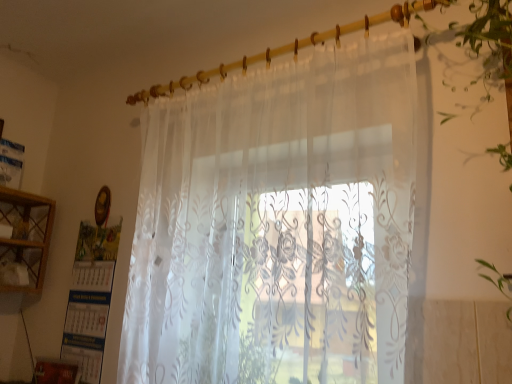
The height and width of the screenshot is (384, 512). What are the coordinates of `wooden cabinet at left` in the screenshot? It's located at (27, 234).

In order to click on translucent floral curtain at right in this screenshot , I will do (x=490, y=58).

Which is in front, translucent floral-patterned curtain at center or translucent floral curtain at right?

Positioned in front is translucent floral curtain at right.

Considering the sizes of objects translucent floral-patterned curtain at center and translucent floral curtain at right in the image provided, who is smaller, translucent floral-patterned curtain at center or translucent floral curtain at right?

Smaller between the two is translucent floral curtain at right.

How much distance is there between translucent floral-patterned curtain at center and translucent floral curtain at right?

translucent floral-patterned curtain at center and translucent floral curtain at right are 62.79 centimeters apart from each other.

Looking at this image, how many degrees apart are the facing directions of wooden cabinet at left and translucent floral-patterned curtain at center?

90.8 degrees separate the facing orientations of wooden cabinet at left and translucent floral-patterned curtain at center.

The image size is (512, 384). In order to click on cabinet lying behind the translucent floral-patterned curtain at center in this screenshot , I will do `click(27, 234)`.

In the scene shown: Considering the relative positions of wooden cabinet at left and translucent floral-patterned curtain at center in the image provided, is wooden cabinet at left to the left of translucent floral-patterned curtain at center from the viewer's perspective?

Correct, you'll find wooden cabinet at left to the left of translucent floral-patterned curtain at center.

From a real-world perspective, is wooden cabinet at left physically located above or below translucent floral-patterned curtain at center?

From a real-world perspective, wooden cabinet at left is physically below translucent floral-patterned curtain at center.

Does translucent floral curtain at right turn towards translucent floral-patterned curtain at center?

No.

Does translucent floral curtain at right lie behind translucent floral-patterned curtain at center?

No, the depth of translucent floral curtain at right is less than that of translucent floral-patterned curtain at center.

Which object is positioned more to the left, translucent floral curtain at right or translucent floral-patterned curtain at center?

Positioned to the left is translucent floral-patterned curtain at center.

Is point (508, 82) positioned before point (309, 336)?

No, (508, 82) is behind (309, 336).

How different are the orientations of translucent floral curtain at right and wooden cabinet at left in degrees?

translucent floral curtain at right and wooden cabinet at left are facing 90.8 degrees away from each other.

Is translucent floral curtain at right next to wooden cabinet at left and touching it?

No, translucent floral curtain at right is not making contact with wooden cabinet at left.

Does point (488, 277) come farther from viewer compared to point (12, 208)?

That is False.

From the picture: Is wooden cabinet at left in contact with translucent floral curtain at right?

No, wooden cabinet at left is not with translucent floral curtain at right.

Does wooden cabinet at left turn towards translucent floral curtain at right?

Yes, wooden cabinet at left is oriented towards translucent floral curtain at right.

From a real-world perspective, does wooden cabinet at left stand above translucent floral curtain at right?

Actually, wooden cabinet at left is physically below translucent floral curtain at right in the real world.

Which object is positioned more to the left, wooden cabinet at left or translucent floral curtain at right?

wooden cabinet at left is more to the left.

Does point (356, 304) appear closer or farther from the camera than point (44, 244)?

Clearly, point (356, 304) is closer to the camera than point (44, 244).

From the image's perspective, which is below, translucent floral-patterned curtain at center or wooden cabinet at left?

wooden cabinet at left, from the image's perspective.

Does translucent floral-patterned curtain at center lie in front of wooden cabinet at left?

Yes, it is in front of wooden cabinet at left.

In order to click on vegetation lying in front of the translucent floral-patterned curtain at center in this screenshot , I will do `click(490, 58)`.

Find the location of a particular element. cabinet below the translucent floral-patterned curtain at center (from a real-world perspective) is located at coordinates (27, 234).

When comparing their distances from translucent floral curtain at right, does translucent floral-patterned curtain at center or wooden cabinet at left seem closer?

translucent floral-patterned curtain at center is positioned closer to the anchor translucent floral curtain at right.

Based on their spatial positions, is translucent floral curtain at right or wooden cabinet at left further from translucent floral-patterned curtain at center?

The object further to translucent floral-patterned curtain at center is wooden cabinet at left.

When comparing their distances from translucent floral-patterned curtain at center, does wooden cabinet at left or translucent floral curtain at right seem further?

Based on the image, wooden cabinet at left appears to be further to translucent floral-patterned curtain at center.

In the scene shown: Looking at the image, which one is located further to wooden cabinet at left, translucent floral-patterned curtain at center or translucent floral curtain at right?

translucent floral curtain at right.

Considering their positions, is translucent floral curtain at right positioned further to wooden cabinet at left than translucent floral-patterned curtain at center?

translucent floral curtain at right.

Looking at the image, which one is located further to translucent floral curtain at right, wooden cabinet at left or translucent floral-patterned curtain at center?

wooden cabinet at left is positioned further to the anchor translucent floral curtain at right.

Image resolution: width=512 pixels, height=384 pixels. Find the location of `curtain situated between wooden cabinet at left and translucent floral curtain at right from left to right`. curtain situated between wooden cabinet at left and translucent floral curtain at right from left to right is located at coordinates coord(278,224).